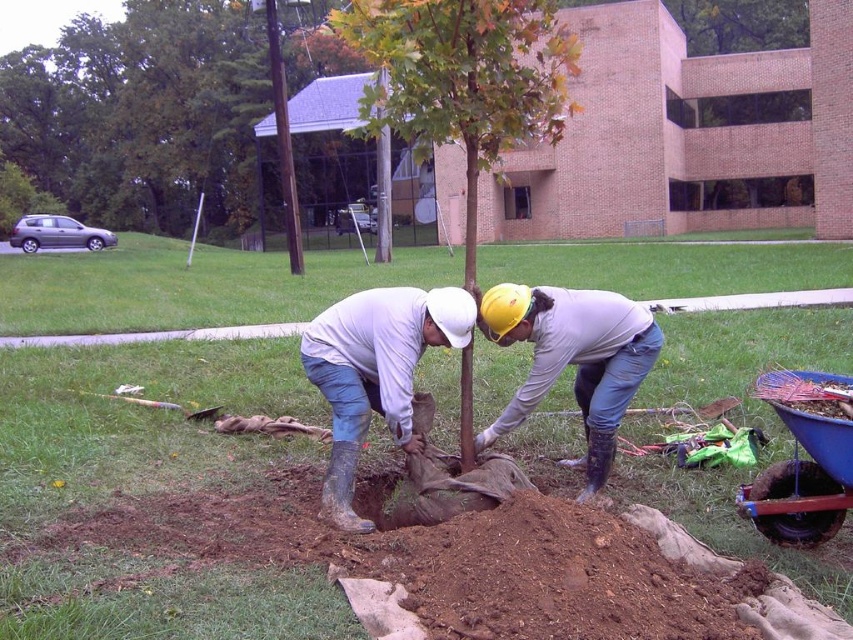
You are standing at the camera position and want to water the green matte tree at center using a hose that can reach 10 feet. Is the hose long enough to reach the tree?

The green matte tree at center is 13.06 feet away from the camera, so the hose cannot reach it since it is longer than 10 feet.

You are a safety inspector checking the planting site. The green matte tree at center and the white matte helmet at center are in the same area. According to safety regulations, the tree must be at least 1 meter away from any hard hat. Is there a potential safety violation here?

The green matte tree at center might be wider than white matte helmet at center, but the description does not provide exact distance between them. Without knowing the actual distance, it is impossible to confirm if they comply with the 1 meter safety regulation.